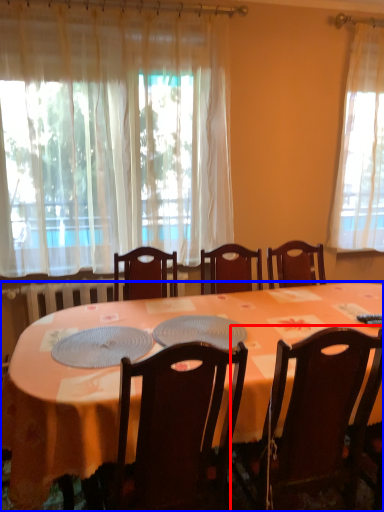
Question: Which object is further to the camera taking this photo, chair (highlighted by a red box) or desk (highlighted by a blue box)?

Choices:
 (A) chair
 (B) desk

Answer: (A)